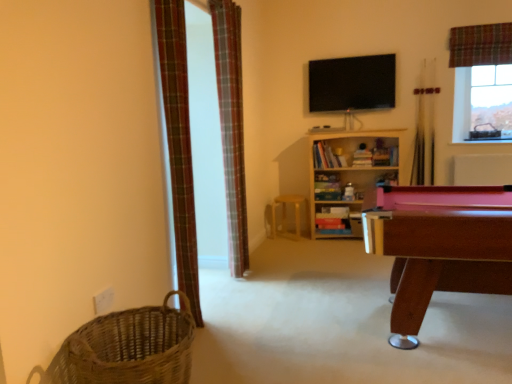
This screenshot has height=384, width=512. I want to click on free space above plaid fabric curtain at upper right, the 3th curtain viewed from the left (from a real-world perspective), so click(x=485, y=17).